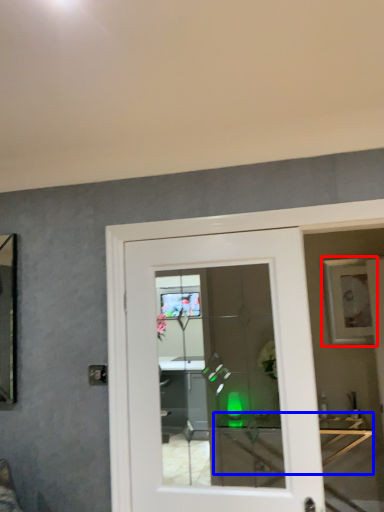
Question: Which point is closer to the camera, picture frame (highlighted by a red box) or table (highlighted by a blue box)?

Choices:
 (A) picture frame
 (B) table

Answer: (B)